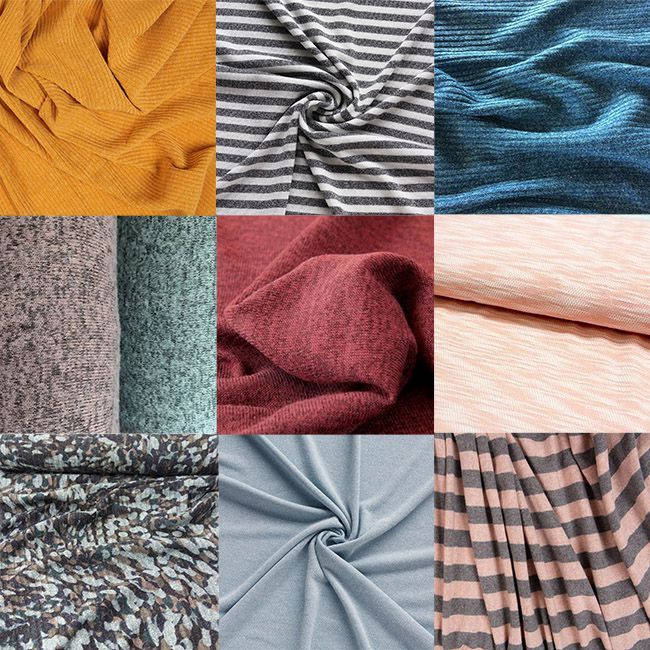
Locate an element on the screen. collage of different fabrics is located at coordinates (x=119, y=162), (x=299, y=123), (x=519, y=107), (x=560, y=236), (x=313, y=301), (x=120, y=306), (x=136, y=523), (x=343, y=526), (x=525, y=521).